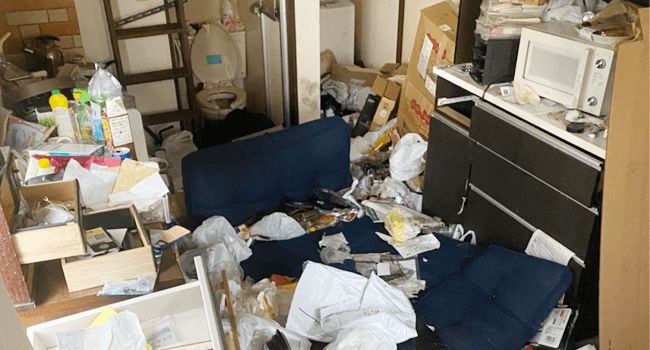
At what (x,y) coordinates should I click in order to perform the action: click on closed boxes. Please return your answer as a coordinate pair (x, y). This screenshot has height=350, width=650. Looking at the image, I should click on (417, 103).